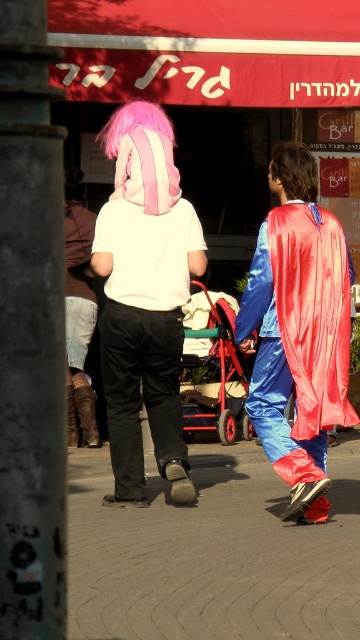
Question: Which of the following is the farthest from the observer?

Choices:
 (A) shiny blue cape at center
 (B) metallic red baby carriage at center
 (C) leather boots at lower left
 (D) gray concrete pavement at center

Answer: (B)

Question: Among these objects, which one is nearest to the camera?

Choices:
 (A) shiny blue cape at center
 (B) metallic red baby carriage at center
 (C) gray concrete pavement at center

Answer: (C)

Question: Is white cotton t-shirt at center smaller than leather boots at lower left?

Choices:
 (A) yes
 (B) no

Answer: (B)

Question: Can you confirm if gray concrete pavement at center is positioned below metallic red baby carriage at center?

Choices:
 (A) no
 (B) yes

Answer: (B)

Question: Observing the image, what is the correct spatial positioning of gray concrete pavement at center in reference to leather boots at lower left?

Choices:
 (A) below
 (B) above

Answer: (A)

Question: Estimate the real-world distances between objects in this image. Which object is farther from the shiny blue cape at center?

Choices:
 (A) white cotton t-shirt at center
 (B) metallic red baby carriage at center
 (C) gray concrete pavement at center

Answer: (B)